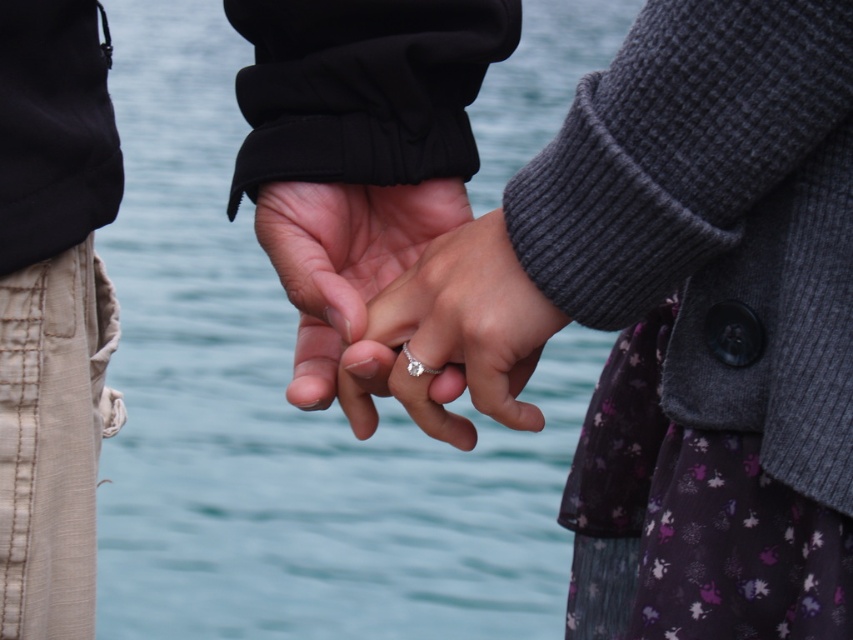
Based on the photo, you are a photographer trying to capture a closeup of the engagement ring on the left person. The ring is located at point [492,323]. You want to ensure that both the ring and the hand of the person on the right at point [408,360] are in focus. Given that your camera can only focus on one plane, which point should you focus on to maximize clarity for both?

You should focus on point [492,323] because it is closer to the camera than point [408,360]. Focusing on the closer point will ensure that the farther point is still within the depth of field, resulting in both being relatively clear.

You are a photographer trying to capture the reflection of the blue water at center and the matte silver ring at center in a photo. Which object will have a bigger reflection in the photo?

The blue water at center has a larger size compared to the matte silver ring at center, so its reflection will be bigger in the photo.

You are a photographer trying to capture the engagement ring at center in your shot. The ring is located at point (347, 276). To ensure the ring is in focus, you need to know its exact position. Which object from the scene is the ring closest to?

The matte silver ring at center is located at point (347, 276), so it is closest to the hand of the person on the right wearing a dark gray, textured sweater with a button detail on the sleeve and a floral patterned skirt with shades of purple and white.